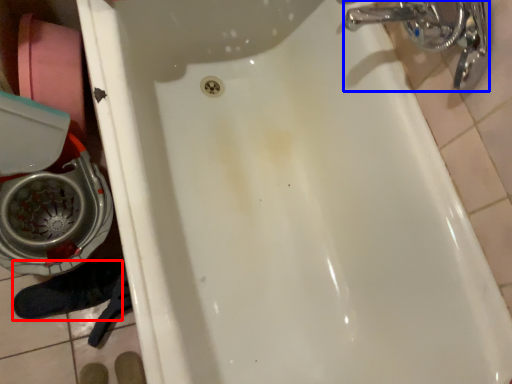
Question: Which object appears closest to the camera in this image, shoe (highlighted by a red box) or plumbing fixture (highlighted by a blue box)?

Choices:
 (A) shoe
 (B) plumbing fixture

Answer: (B)